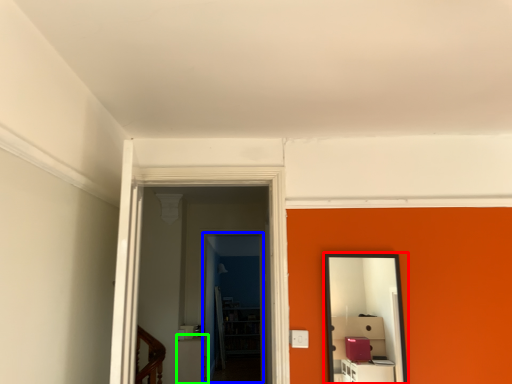
Question: Which object is the farthest from mirror (highlighted by a red box)? Choose among these: glass door (highlighted by a blue box) or furniture (highlighted by a green box).

Choices:
 (A) glass door
 (B) furniture

Answer: (A)